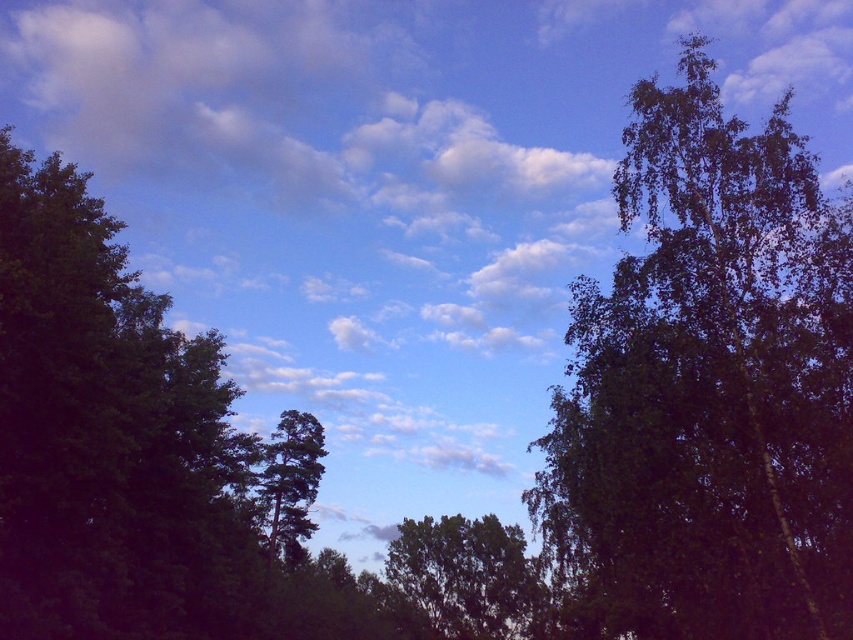
Which is in front, point (595, 618) or point (300, 476)?

Point (595, 618)

What are the coordinates of `green leafy tree at right` in the screenshot? It's located at (711, 387).

Where is `green leafy tree at right`? This screenshot has width=853, height=640. green leafy tree at right is located at coordinates (711, 387).

At what (x,y) coordinates should I click in order to perform the action: click on green leafy tree at right. Please return your answer as a coordinate pair (x, y). Looking at the image, I should click on (711, 387).

Who is positioned more to the left, green leafy tree at center or green matte tree at center?

Positioned to the left is green matte tree at center.

Is green leafy tree at center thinner than green matte tree at center?

In fact, green leafy tree at center might be wider than green matte tree at center.

The image size is (853, 640). What do you see at coordinates (466, 576) in the screenshot? I see `green leafy tree at center` at bounding box center [466, 576].

What are the coordinates of `green leafy tree at center` in the screenshot? It's located at (466, 576).

Which of these two, green leafy tree at right or green leafy tree at center, stands shorter?

green leafy tree at center is shorter.

Between green leafy tree at right and green leafy tree at center, which one is positioned lower?

Positioned lower is green leafy tree at center.

This screenshot has width=853, height=640. Identify the location of green leafy tree at right. (711, 387).